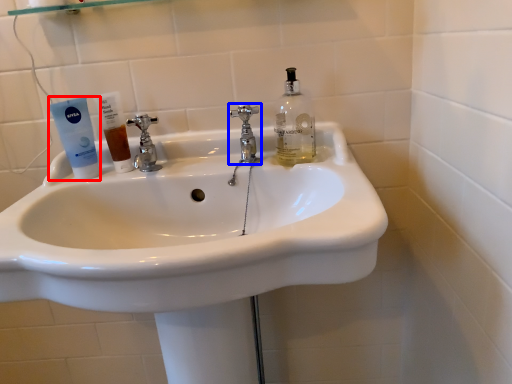
Question: Which object is further to the camera taking this photo, toothpaste (highlighted by a red box) or tap (highlighted by a blue box)?

Choices:
 (A) toothpaste
 (B) tap

Answer: (B)